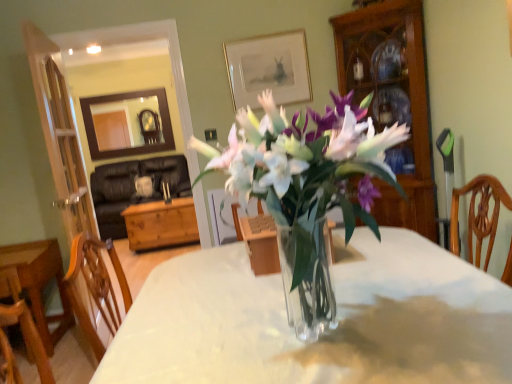
Image resolution: width=512 pixels, height=384 pixels. In order to click on vacant location below clear glass vase at center (from a real-world perspective) in this screenshot , I will do `click(315, 337)`.